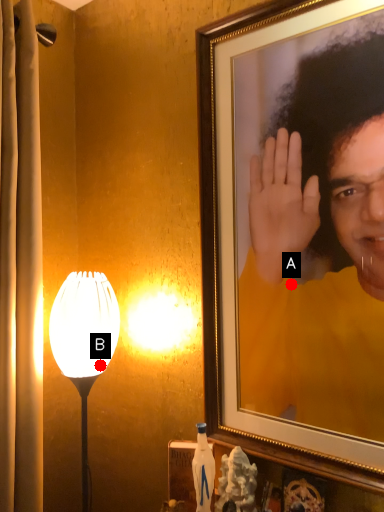
Question: Two points are circled on the image, labeled by A and B beside each circle. Which point is closer to the camera taking this photo?

Choices:
 (A) A is closer
 (B) B is closer

Answer: (A)